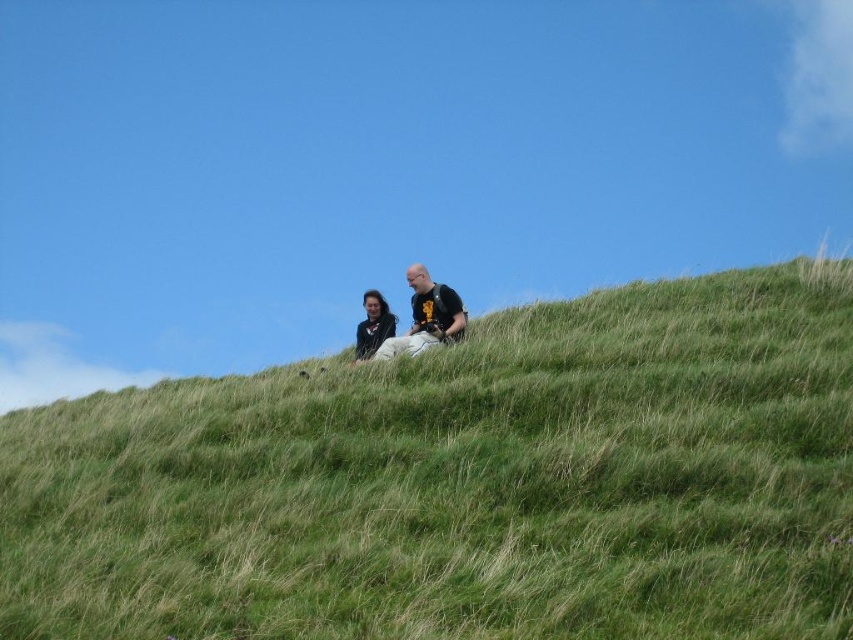
You are standing on the green grassy hillside at upper center and want to reach the smooth black jacket at center. Which direction should you move to get closer to it?

The green grassy hillside at upper center is below the smooth black jacket at center, so you should move upward to reach it.

You are standing on the grassy hill and want to hand a book to the person wearing the black matte shirt at center. Which direction should you walk to reach them first, considering the smooth black jacket at center is behind them?

The black matte shirt at center is closer to the viewer than the smooth black jacket at center, so you should walk directly towards the black matte shirt at center as they are in front of the smooth black jacket at center.